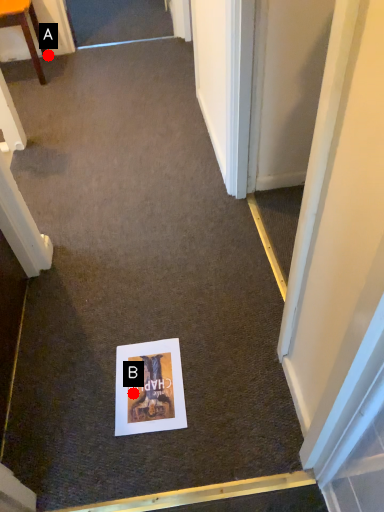
Question: Two points are circled on the image, labeled by A and B beside each circle. Among these points, which one is nearest to the camera?

Choices:
 (A) A is closer
 (B) B is closer

Answer: (B)